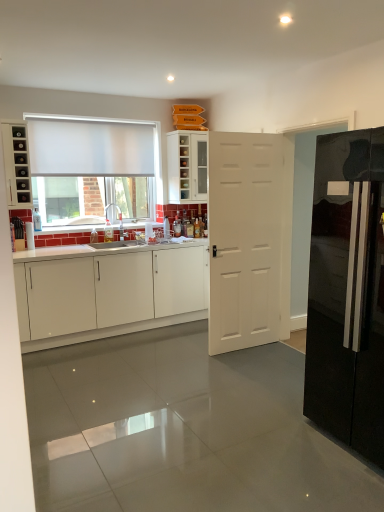
Question: Does white glossy cabinet at upper center, which ranks as the 1th cabinetry in top-to-bottom order, have a greater height compared to white matte door at center?

Choices:
 (A) no
 (B) yes

Answer: (A)

Question: From a real-world perspective, is white glossy cabinet at upper center, which is counted as the third cabinetry, starting from the bottom, on white matte door at center?

Choices:
 (A) yes
 (B) no

Answer: (A)

Question: From the image's perspective, is white glossy cabinet at upper center, which is counted as the third cabinetry, starting from the bottom, below white matte door at center?

Choices:
 (A) yes
 (B) no

Answer: (B)

Question: Is the depth of white glossy cabinet at upper center, which is counted as the third cabinetry, starting from the bottom, greater than that of white matte door at center?

Choices:
 (A) yes
 (B) no

Answer: (A)

Question: Considering the relative sizes of white glossy cabinet at upper center, which ranks as the 1th cabinetry in top-to-bottom order, and white matte door at center in the image provided, is white glossy cabinet at upper center, which ranks as the 1th cabinetry in top-to-bottom order, wider than white matte door at center?

Choices:
 (A) no
 (B) yes

Answer: (B)

Question: Is point (11, 150) positioned closer to the camera than point (41, 120)?

Choices:
 (A) closer
 (B) farther

Answer: (A)

Question: Is matte black cabinet at left, the second cabinetry from the top, to the left or to the right of frosted glass window at upper left in the image?

Choices:
 (A) left
 (B) right

Answer: (A)

Question: Choose the correct answer: Is matte black cabinet at left, which ranks as the second cabinetry in bottom-to-top order, inside frosted glass window at upper left or outside it?

Choices:
 (A) outside
 (B) inside

Answer: (A)

Question: Based on their sizes in the image, would you say matte black cabinet at left, which ranks as the second cabinetry in bottom-to-top order, is bigger or smaller than frosted glass window at upper left?

Choices:
 (A) small
 (B) big

Answer: (A)

Question: Would you say glossy black refrigerator at right is inside or outside frosted glass window at upper left?

Choices:
 (A) inside
 (B) outside

Answer: (B)

Question: Is point click(x=362, y=203) closer or farther from the camera than point click(x=155, y=132)?

Choices:
 (A) closer
 (B) farther

Answer: (A)

Question: From a real-world perspective, is glossy black refrigerator at right positioned above or below frosted glass window at upper left?

Choices:
 (A) above
 (B) below

Answer: (B)

Question: From the image's perspective, relative to frosted glass window at upper left, is glossy black refrigerator at right above or below?

Choices:
 (A) above
 (B) below

Answer: (B)

Question: From the image's perspective, relative to white glossy cabinet at upper center, which ranks as the 1th cabinetry in top-to-bottom order, is frosted glass window at upper left above or below?

Choices:
 (A) below
 (B) above

Answer: (A)

Question: Is point (150, 122) positioned closer to the camera than point (188, 175)?

Choices:
 (A) closer
 (B) farther

Answer: (A)